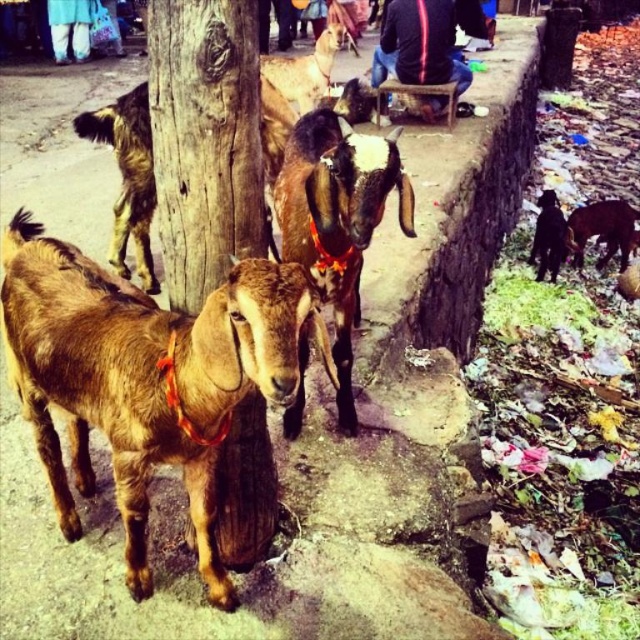
Does brown woolen goat at center come behind brown rough fur goat at left?

No.

Which is behind, point (220, 346) or point (276, 124)?

The point (276, 124) is more distant.

Locate an element on the screen. This screenshot has height=640, width=640. brown woolen goat at center is located at coordinates click(x=144, y=378).

Does brown matte goat at center come in front of brown woolen goat at right?

Yes.

Image resolution: width=640 pixels, height=640 pixels. I want to click on brown matte goat at center, so click(337, 218).

Is brown matte goat at center above brown rough fur goat at left?

No, brown matte goat at center is not above brown rough fur goat at left.

Between point (397, 128) and point (275, 250), which one is positioned behind?

Positioned behind is point (397, 128).

Where is `brown matte goat at center`? The image size is (640, 640). brown matte goat at center is located at coordinates (337, 218).